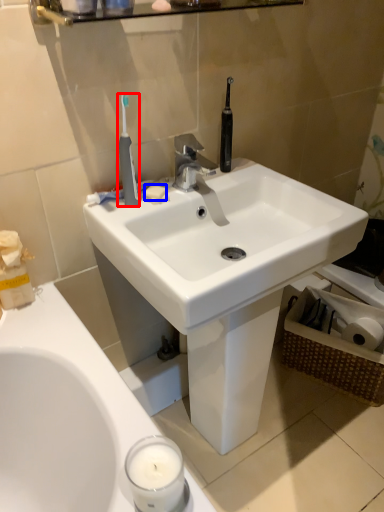
Question: Which point is further to the camera, toothbrush (highlighted by a red box) or soap (highlighted by a blue box)?

Choices:
 (A) toothbrush
 (B) soap

Answer: (B)